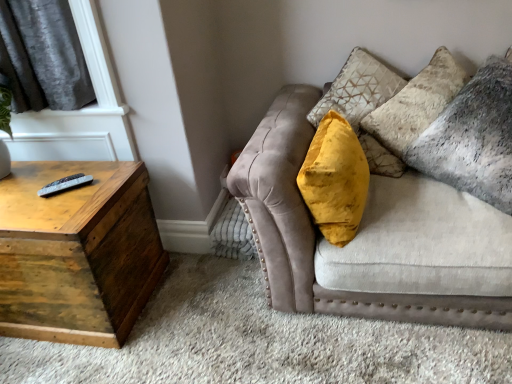
Question: Is velvet gray pillow at upper right wider or thinner than wooden trunk at left?

Choices:
 (A) wide
 (B) thin

Answer: (A)

Question: Which is correct: velvet gray pillow at upper right is inside wooden trunk at left, or outside of it?

Choices:
 (A) inside
 (B) outside

Answer: (B)

Question: Estimate the real-world distances between objects in this image. Which object is farther from the velvet beige couch at upper right?

Choices:
 (A) velvet yellow pillow at center
 (B) velvet gray pillow at upper right
 (C) black plastic remote at left
 (D) wooden trunk at left

Answer: (C)

Question: Estimate the real-world distances between objects in this image. Which object is farther from the black plastic remote at left?

Choices:
 (A) velvet gray pillow at upper right
 (B) wooden trunk at left
 (C) velvet yellow pillow at center
 (D) velvet beige couch at upper right

Answer: (A)